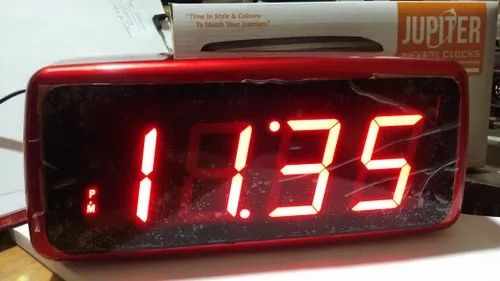
Where is `red clipboard`? red clipboard is located at coordinates click(14, 219).